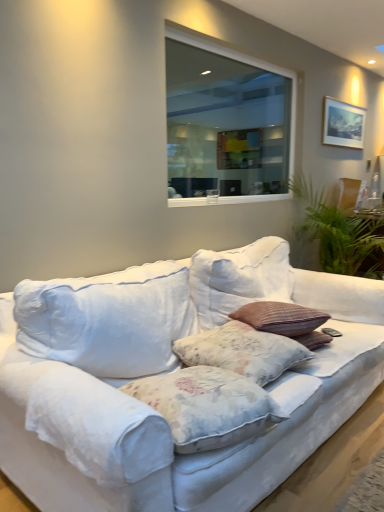
Question: From a real-world perspective, is white fabric couch at center positioned above or below green leafy plant at right?

Choices:
 (A) below
 (B) above

Answer: (A)

Question: Is point (292, 286) closer or farther from the camera than point (362, 252)?

Choices:
 (A) closer
 (B) farther

Answer: (A)

Question: Which object is the closest to the metallic silver picture frame at upper right?

Choices:
 (A) floral fabric pillow at center, which appears as the 1th pillow when viewed from the back
 (B) white fabric couch at center
 (C) transparent glass window at upper center
 (D) floral fabric pillow at center, which ranks as the second pillow in back-to-front order
 (E) green leafy plant at right

Answer: (E)

Question: Which is nearer to the floral fabric pillow at center, the second pillow from the front?

Choices:
 (A) floral fabric pillow at center, which ranks as the second pillow in back-to-front order
 (B) white fabric couch at center
 (C) green leafy plant at right
 (D) transparent glass window at upper center
 (E) metallic silver picture frame at upper right

Answer: (A)